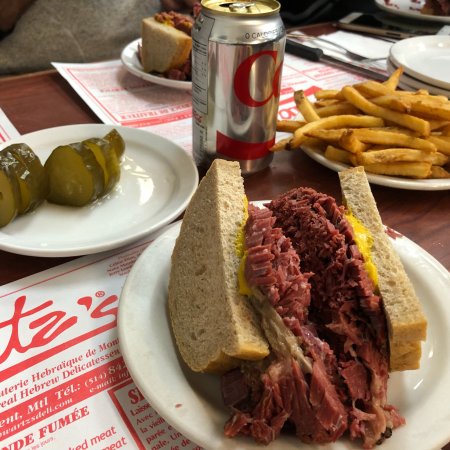
The height and width of the screenshot is (450, 450). What are the coordinates of `smaller plate` in the screenshot? It's located at (93, 245).